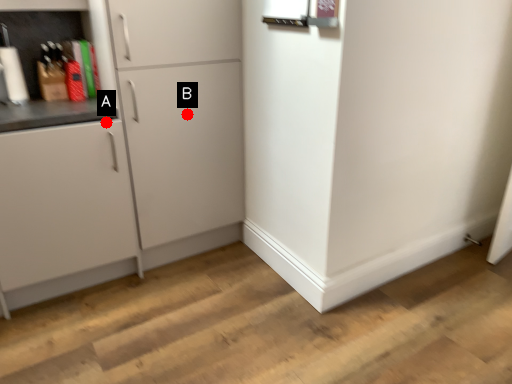
Question: Two points are circled on the image, labeled by A and B beside each circle. Which point is further to the camera?

Choices:
 (A) A is further
 (B) B is further

Answer: (B)